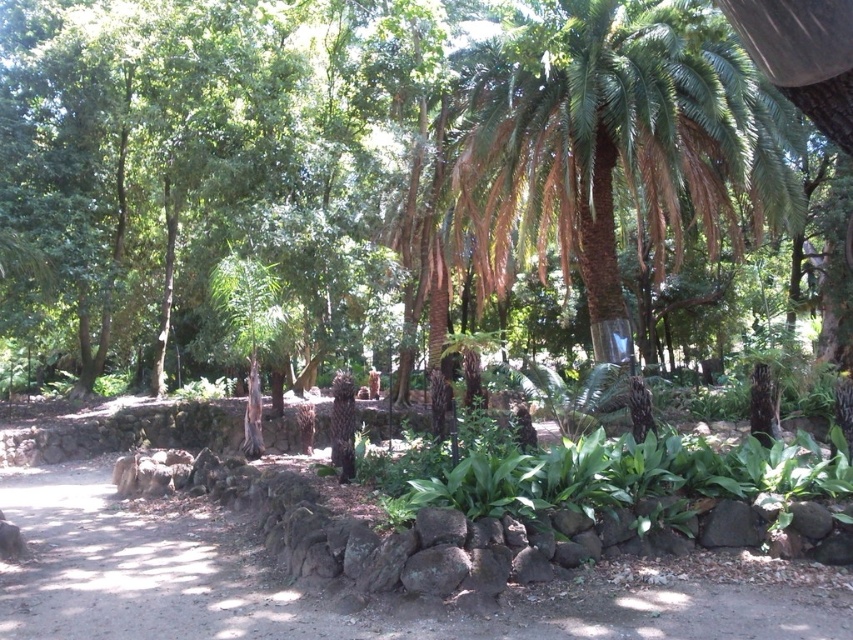
Who is more distant from viewer, (511, 109) or (753, 608)?

The point (511, 109) is more distant.

Is green leafy palm at upper right to the right of dirt path at center from the viewer's perspective?

Indeed, green leafy palm at upper right is positioned on the right side of dirt path at center.

Is point (639, 72) positioned after point (374, 612)?

Yes, point (639, 72) is farther from viewer.

At what (x,y) coordinates should I click in order to perform the action: click on green leafy palm at upper right. Please return your answer as a coordinate pair (x, y). Image resolution: width=853 pixels, height=640 pixels. Looking at the image, I should click on (616, 140).